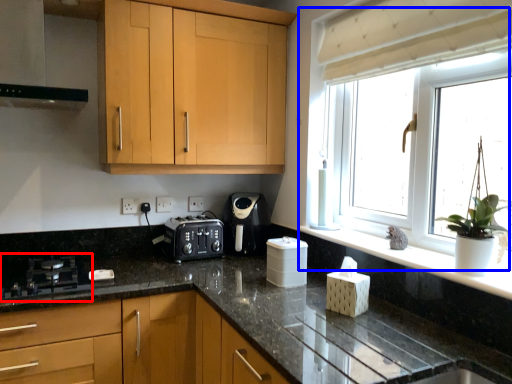
Question: Which point is further to the camera, gas stove (highlighted by a red box) or window (highlighted by a blue box)?

Choices:
 (A) gas stove
 (B) window

Answer: (A)